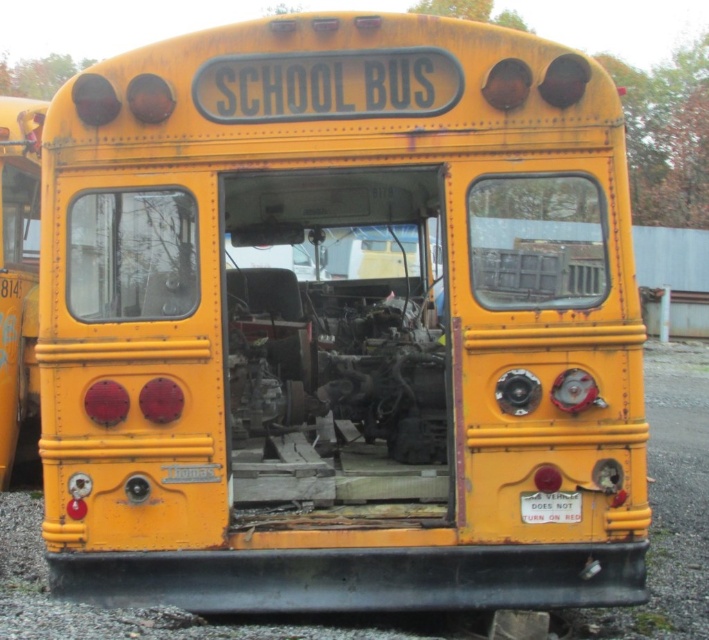
Is matte yellow school bus at left smaller than metallic gray license plate at center?

No.

Does point (33, 109) lie in front of point (554, 512)?

No, it is not.

Is point (9, 129) farther from viewer compared to point (549, 496)?

Yes.

This screenshot has height=640, width=709. I want to click on matte yellow school bus at left, so click(16, 269).